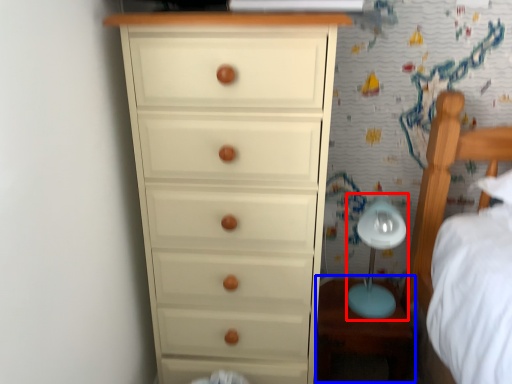
Question: Which object is further to the camera taking this photo, table lamp (highlighted by a red box) or table (highlighted by a blue box)?

Choices:
 (A) table lamp
 (B) table

Answer: (B)